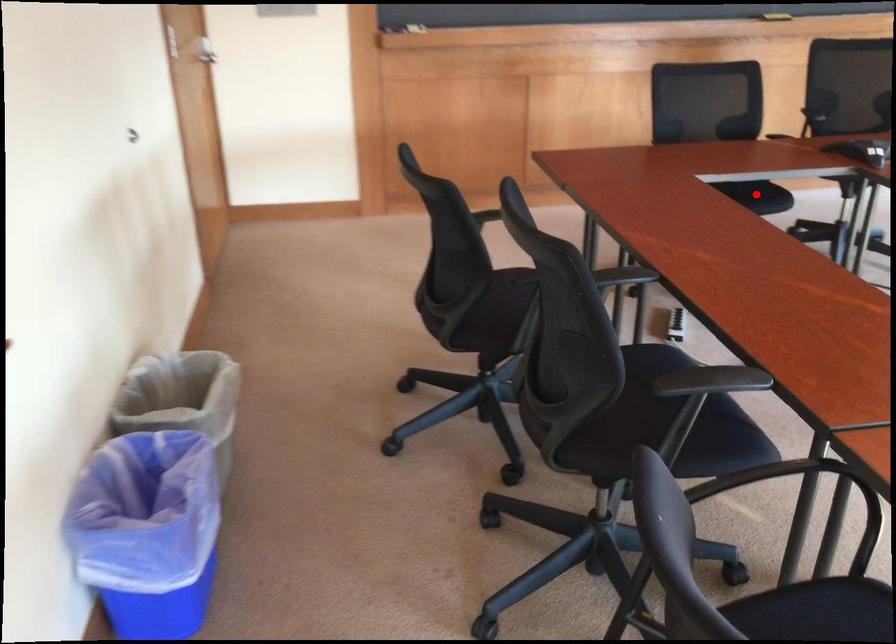
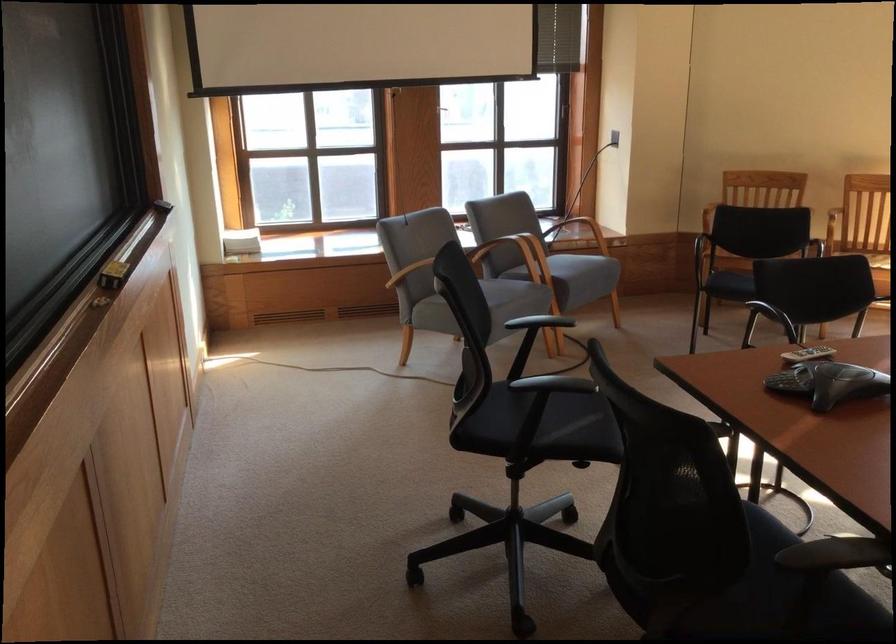
Question: I am providing you with two images of the same scene from different viewpoints. A red point is marked on the first image. Can you still see the location of the red point in image 2?

Choices:
 (A) Yes
 (B) No

Answer: (B)